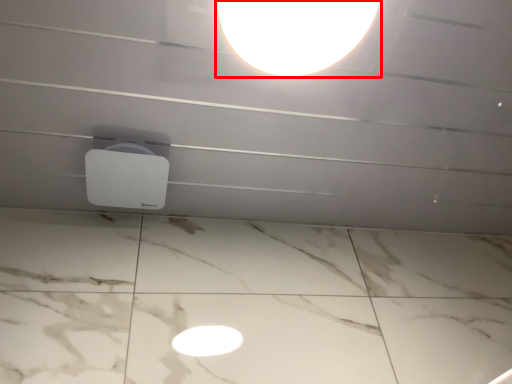
Question: In this image, where is lamp (annotated by the red box) located relative to lamp?

Choices:
 (A) right
 (B) left

Answer: (A)